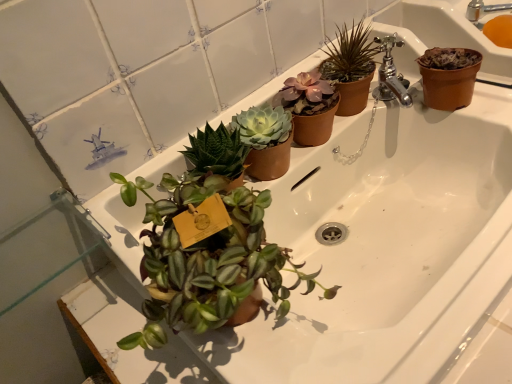
Describe the element at coordinates (492, 22) in the screenshot. I see `metallic silver faucet at upper right` at that location.

Identify the location of metallic silver faucet at upper right. (492, 22).

Locate an element on the screen. matte brown pot at upper center is located at coordinates (350, 66).

What do you see at coordinates (350, 66) in the screenshot? The image size is (512, 384). I see `matte brown pot at upper center` at bounding box center [350, 66].

Where is `metallic silver faucet at upper right`? The height and width of the screenshot is (384, 512). metallic silver faucet at upper right is located at coordinates click(492, 22).

Considering the relative positions of metallic silver faucet at upper right and matte brown pot at upper center in the image provided, is metallic silver faucet at upper right to the left or to the right of matte brown pot at upper center?

metallic silver faucet at upper right is positioned on matte brown pot at upper center's right side.

Is metallic silver faucet at upper right positioned before matte brown pot at upper center?

No, metallic silver faucet at upper right is behind matte brown pot at upper center.

Does point (479, 28) lie behind point (366, 34)?

Yes, it is.

From the image's perspective, is metallic silver faucet at upper right beneath matte brown pot at upper center?

No, from the image's perspective, metallic silver faucet at upper right is not beneath matte brown pot at upper center.

From a real-world perspective, is metallic silver faucet at upper right positioned above or below matte brown pot at upper center?

From a real-world perspective, metallic silver faucet at upper right is physically below matte brown pot at upper center.

Which object is wider, metallic silver faucet at upper right or matte brown pot at upper center?

With larger width is metallic silver faucet at upper right.

Which of these two, metallic silver faucet at upper right or matte brown pot at upper center, stands taller?

Standing taller between the two is matte brown pot at upper center.

In the scene shown: Based on their sizes in the image, would you say metallic silver faucet at upper right is bigger or smaller than matte brown pot at upper center?

Clearly, metallic silver faucet at upper right is smaller in size than matte brown pot at upper center.

Is matte brown pot at upper center located within metallic silver faucet at upper right?

Definitely not — matte brown pot at upper center is not inside metallic silver faucet at upper right.

Are metallic silver faucet at upper right and matte brown pot at upper center beside each other?

No, metallic silver faucet at upper right is not next to matte brown pot at upper center.

Is metallic silver faucet at upper right positioned with its back to matte brown pot at upper center?

metallic silver faucet at upper right is not turned away from matte brown pot at upper center.

Locate an element on the screen. This screenshot has width=512, height=384. houseplant that is below the metallic silver faucet at upper right (from the image's perspective) is located at coordinates [350, 66].

Considering the relative positions of matte brown pot at upper center and metallic silver faucet at upper right in the image provided, is matte brown pot at upper center to the left or to the right of metallic silver faucet at upper right?

Clearly, matte brown pot at upper center is on the left of metallic silver faucet at upper right in the image.

Is matte brown pot at upper center closer to the viewer compared to metallic silver faucet at upper right?

Yes, it is.

Which is less distant, (x=355, y=65) or (x=485, y=6)?

The point (x=355, y=65) is more forward.

From the image's perspective, which one is positioned higher, matte brown pot at upper center or metallic silver faucet at upper right?

metallic silver faucet at upper right.

From a real-world perspective, is matte brown pot at upper center positioned over metallic silver faucet at upper right based on gravity?

Yes, from a real-world perspective, matte brown pot at upper center is on top of metallic silver faucet at upper right.

Which object is thinner, matte brown pot at upper center or metallic silver faucet at upper right?

Thinner between the two is matte brown pot at upper center.

In the scene shown: Between matte brown pot at upper center and metallic silver faucet at upper right, which one has less height?

metallic silver faucet at upper right.

Who is smaller, matte brown pot at upper center or metallic silver faucet at upper right?

metallic silver faucet at upper right is smaller.

Which is correct: matte brown pot at upper center is inside metallic silver faucet at upper right, or outside of it?

The correct answer is: outside.

Is matte brown pot at upper center far from metallic silver faucet at upper right?

No, matte brown pot at upper center is not far away from metallic silver faucet at upper right.

Does matte brown pot at upper center turn towards metallic silver faucet at upper right?

No, matte brown pot at upper center is not turned towards metallic silver faucet at upper right.

Where is `sink lying on the right of matte brown pot at upper center`? The width and height of the screenshot is (512, 384). sink lying on the right of matte brown pot at upper center is located at coordinates (492, 22).

Identify the location of houseplant on the left of metallic silver faucet at upper right. click(350, 66).

Identify the location of sink lying on the right of matte brown pot at upper center. (492, 22).